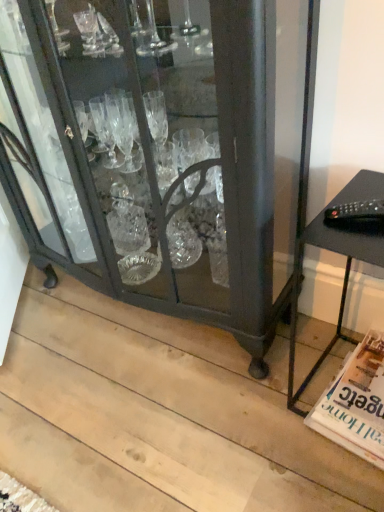
Question: Considering the relative sizes of black matte table at right and white glossy magazine at lower right in the image provided, is black matte table at right wider than white glossy magazine at lower right?

Choices:
 (A) yes
 (B) no

Answer: (B)

Question: From the image's perspective, does black matte table at right appear higher than white glossy magazine at lower right?

Choices:
 (A) yes
 (B) no

Answer: (A)

Question: Are black matte table at right and white glossy magazine at lower right far apart?

Choices:
 (A) yes
 (B) no

Answer: (B)

Question: Is white glossy magazine at lower right surrounded by black matte table at right?

Choices:
 (A) no
 (B) yes

Answer: (B)

Question: Can you confirm if black matte table at right is thinner than white glossy magazine at lower right?

Choices:
 (A) yes
 (B) no

Answer: (A)

Question: From their relative heights in the image, would you say matte black cabinet at center is taller or shorter than white glossy magazine at lower right?

Choices:
 (A) short
 (B) tall

Answer: (B)

Question: Looking at the image, does matte black cabinet at center seem bigger or smaller compared to white glossy magazine at lower right?

Choices:
 (A) big
 (B) small

Answer: (A)

Question: Visually, is matte black cabinet at center positioned to the left or to the right of white glossy magazine at lower right?

Choices:
 (A) right
 (B) left

Answer: (B)

Question: Relative to white glossy magazine at lower right, is matte black cabinet at center in front or behind?

Choices:
 (A) front
 (B) behind

Answer: (A)

Question: Is matte black cabinet at center inside the boundaries of black matte table at right, or outside?

Choices:
 (A) outside
 (B) inside

Answer: (A)

Question: Is matte black cabinet at center to the left or to the right of black matte table at right in the image?

Choices:
 (A) right
 (B) left

Answer: (B)

Question: From their relative heights in the image, would you say matte black cabinet at center is taller or shorter than black matte table at right?

Choices:
 (A) tall
 (B) short

Answer: (A)

Question: In terms of width, does matte black cabinet at center look wider or thinner when compared to black matte table at right?

Choices:
 (A) wide
 (B) thin

Answer: (A)

Question: From their relative heights in the image, would you say white glossy magazine at lower right is taller or shorter than black matte table at right?

Choices:
 (A) tall
 (B) short

Answer: (B)

Question: Which is correct: white glossy magazine at lower right is inside black matte table at right, or outside of it?

Choices:
 (A) outside
 (B) inside

Answer: (B)